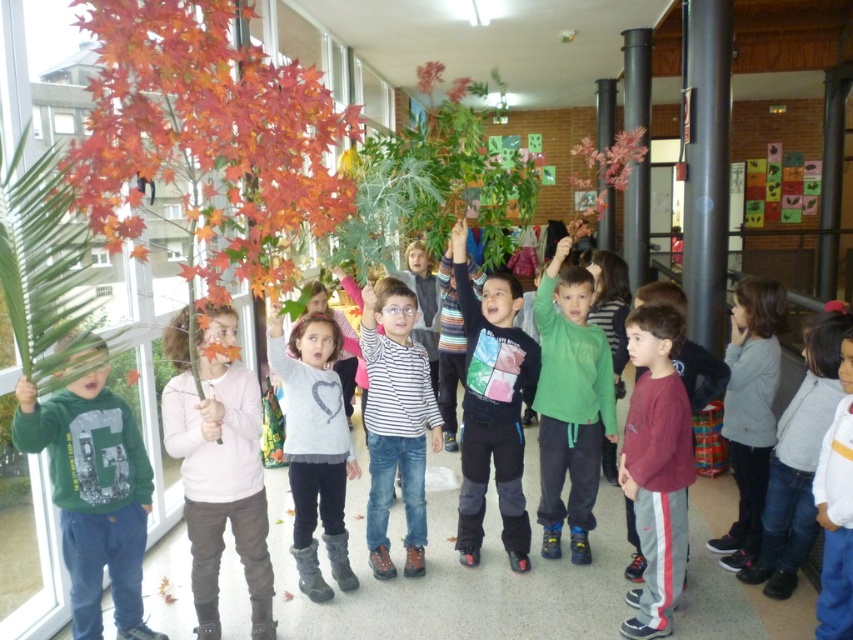
You are a photographer trying to capture the children holding branches with colorful leaves. You notice a point at coordinates (x=570, y=403) in the image. Based on the scene description, where is this point located?

The point at coordinates (x=570, y=403) is on the green matte shirt at center.